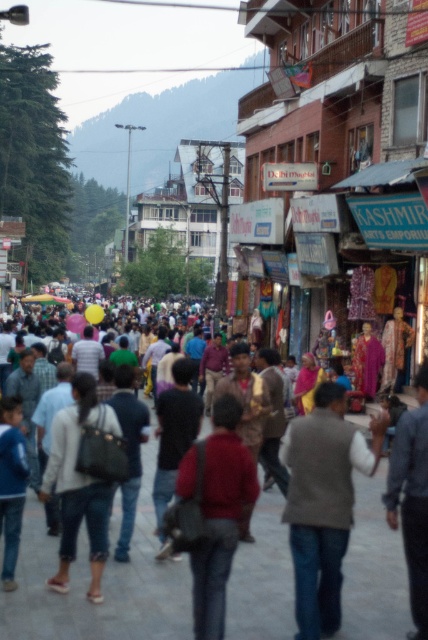
You are a tailor standing in the middle of the bustling street scene. You see the multicolored clothing at center and the brown woolen vest at center. Can you walk directly between them without needing to move any items?

The distance between the multicolored clothing at center and the brown woolen vest at center is 8.87 feet, so yes, you can walk directly between them without needing to move any items as there is sufficient space.

You are a traveler standing on the street and want to buy a souvenir. You see both the multicolored clothing at center and the brown woolen vest at center. Which item is positioned lower on your view?

The multicolored clothing at center is located below the brown woolen vest at center, so it is positioned lower on your view.